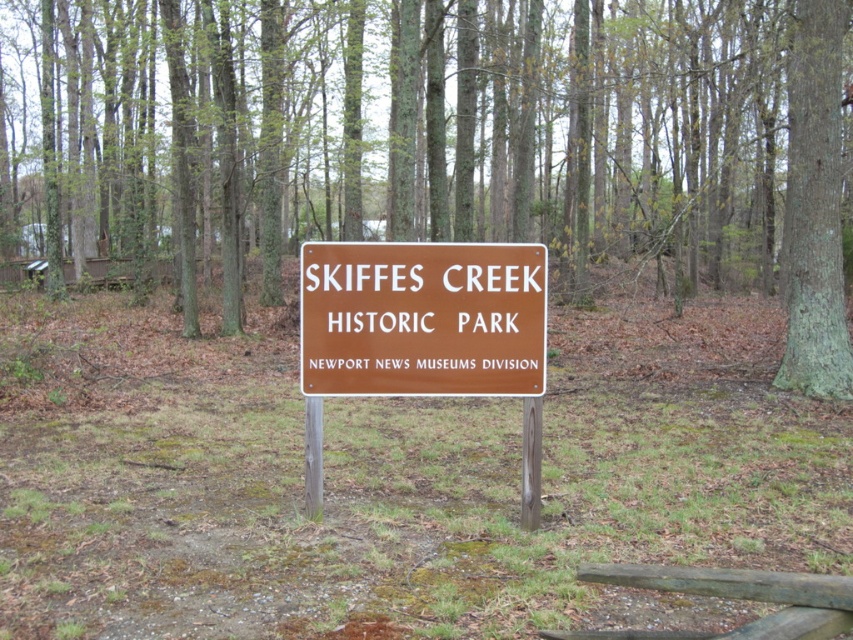
Question: Is green bark tree at center wider than brown wooden fence at lower right?

Choices:
 (A) no
 (B) yes

Answer: (B)

Question: Is green bark tree at center closer to camera compared to smooth brown bark at center right?

Choices:
 (A) yes
 (B) no

Answer: (A)

Question: Which object is the closest to the smooth brown bark at center right?

Choices:
 (A) brown wooden fence at lower right
 (B) brown wooden sign at center

Answer: (B)

Question: Based on their relative distances, which object is farther from the smooth brown bark at center right?

Choices:
 (A) green bark tree at center
 (B) brown wooden sign at center
 (C) brown wooden fence at lower right

Answer: (A)

Question: Which object is the closest to the brown wooden fence at lower right?

Choices:
 (A) brown wooden sign at center
 (B) smooth brown bark at center right
 (C) green bark tree at center

Answer: (A)

Question: Can you confirm if green bark tree at center is positioned to the right of brown wooden sign at center?

Choices:
 (A) no
 (B) yes

Answer: (A)